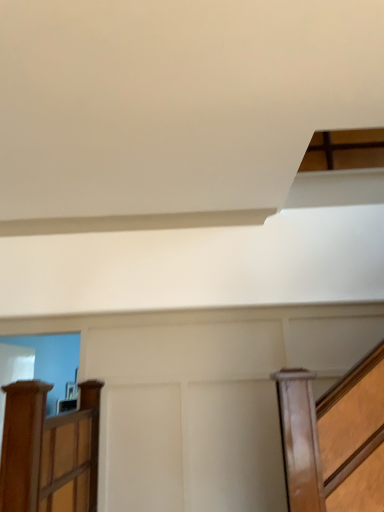
The width and height of the screenshot is (384, 512). Describe the element at coordinates (344, 150) in the screenshot. I see `clear glass window at upper right` at that location.

Locate an element on the screen. clear glass window at upper right is located at coordinates (344, 150).

I want to click on clear glass window at upper right, so click(344, 150).